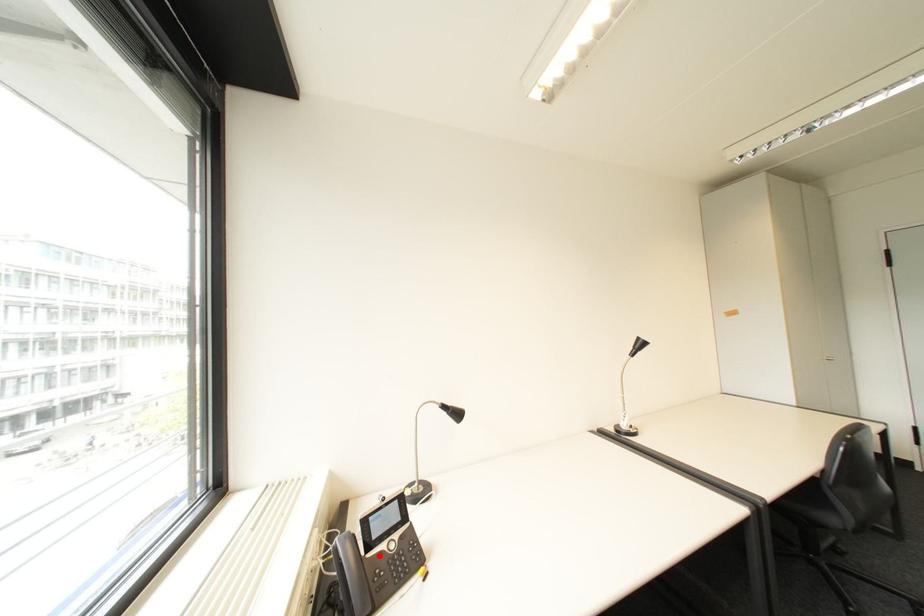
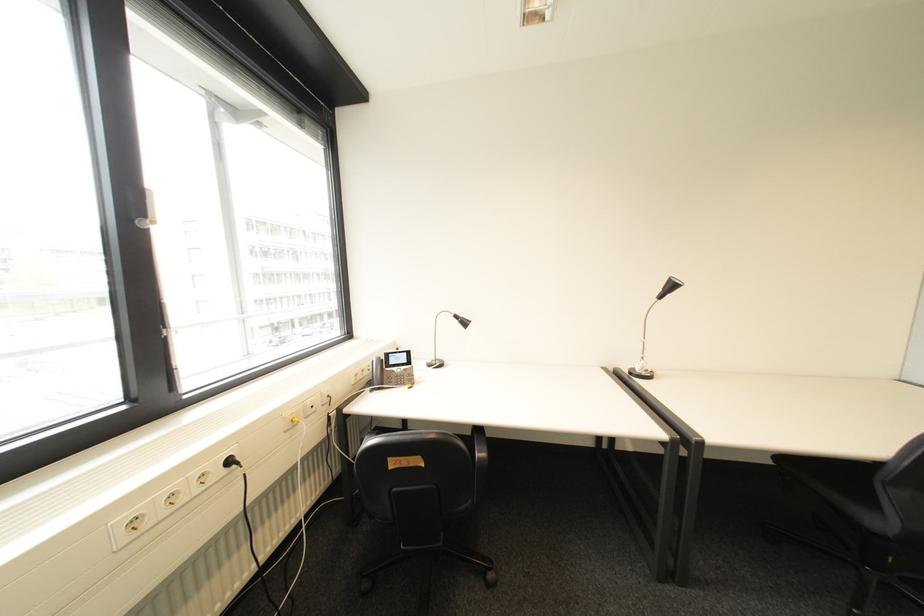
The point at the highlighted location is marked in the first image. Where is the corresponding point in the second image?

(396, 370)